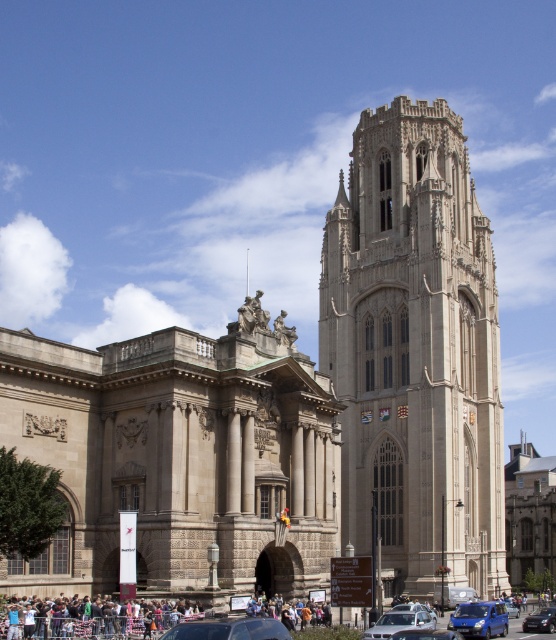
Question: Which object is the closest to the metallic blue sedan at lower right?

Choices:
 (A) multicolored fabric crowd at lower center
 (B) metallic silver car at lower center
 (C) silver metallic car at lower center
 (D) beige stone tower at center

Answer: (C)

Question: Which object is closer to the camera taking this photo?

Choices:
 (A) metallic silver car at center
 (B) blue matte van at lower right
 (C) blue metallic van at lower center
 (D) metallic silver car at lower center

Answer: (D)

Question: Does blue matte van at lower right appear on the right side of metallic blue sedan at lower right?

Choices:
 (A) yes
 (B) no

Answer: (B)

Question: Does multicolored fabric crowd at lower center have a lesser width compared to metallic blue sedan at lower right?

Choices:
 (A) no
 (B) yes

Answer: (B)

Question: Does beige stone tower at center have a smaller size compared to metallic blue sedan at lower right?

Choices:
 (A) yes
 (B) no

Answer: (B)

Question: Among these objects, which one is farthest from the camera?

Choices:
 (A) silver metallic car at lower center
 (B) metallic blue sedan at lower right
 (C) multicolored fabric crowd at lower center

Answer: (B)